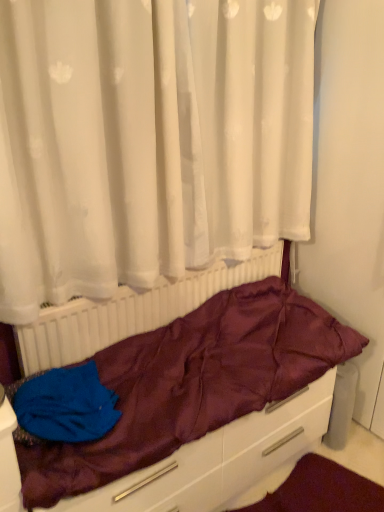
Question: Are blue fabric at lower left and maroon satin sleeping bag at center making contact?

Choices:
 (A) yes
 (B) no

Answer: (B)

Question: Is blue fabric at lower left facing away from maroon satin sleeping bag at center?

Choices:
 (A) no
 (B) yes

Answer: (B)

Question: Would you say maroon satin sleeping bag at center is part of blue fabric at lower left's contents?

Choices:
 (A) yes
 (B) no

Answer: (B)

Question: Can you confirm if blue fabric at lower left is shorter than maroon satin sleeping bag at center?

Choices:
 (A) yes
 (B) no

Answer: (A)

Question: From the image's perspective, is blue fabric at lower left located beneath maroon satin sleeping bag at center?

Choices:
 (A) yes
 (B) no

Answer: (A)

Question: From the image's perspective, is maroon satin sleeping bag at center located above or below white plastic radiator at center?

Choices:
 (A) above
 (B) below

Answer: (B)

Question: Is point (150, 339) closer or farther from the camera than point (167, 291)?

Choices:
 (A) farther
 (B) closer

Answer: (B)

Question: Would you say maroon satin sleeping bag at center is to the left or to the right of white plastic radiator at center in the picture?

Choices:
 (A) left
 (B) right

Answer: (B)

Question: Would you say maroon satin sleeping bag at center is inside or outside white plastic radiator at center?

Choices:
 (A) inside
 (B) outside

Answer: (B)

Question: Does point (246, 177) appear closer or farther from the camera than point (34, 352)?

Choices:
 (A) closer
 (B) farther

Answer: (B)

Question: From their relative heights in the image, would you say white sheer curtain at upper center is taller or shorter than white plastic radiator at center?

Choices:
 (A) tall
 (B) short

Answer: (A)

Question: From the image's perspective, is white sheer curtain at upper center above or below white plastic radiator at center?

Choices:
 (A) below
 (B) above

Answer: (B)

Question: From a real-world perspective, is white sheer curtain at upper center physically located above or below white plastic radiator at center?

Choices:
 (A) above
 (B) below

Answer: (A)

Question: Is white plastic radiator at center in front of or behind white sheer curtain at upper center in the image?

Choices:
 (A) front
 (B) behind

Answer: (B)

Question: Considering the positions of white plastic radiator at center and white sheer curtain at upper center in the image, is white plastic radiator at center taller or shorter than white sheer curtain at upper center?

Choices:
 (A) short
 (B) tall

Answer: (A)